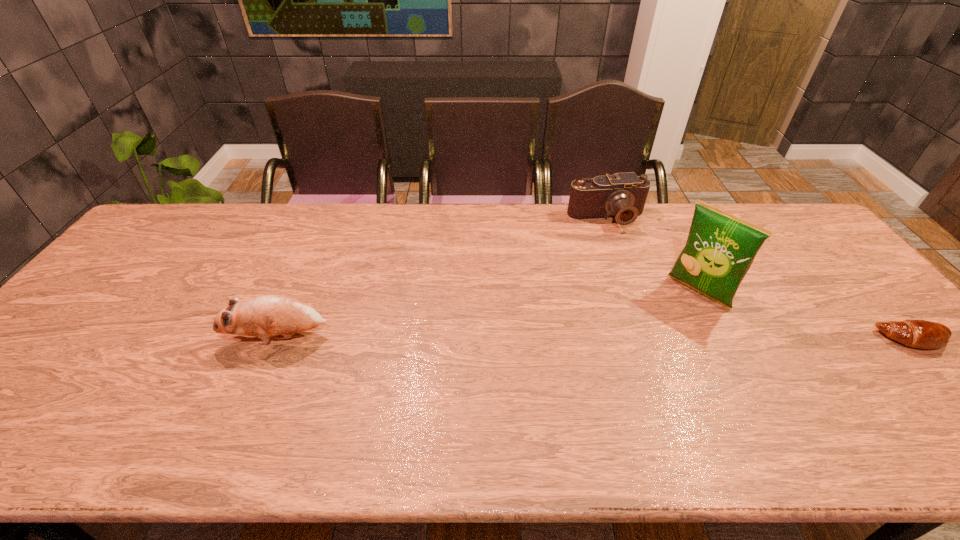
Where is `vacant spot on the desktop that is between the hamster and the rightmost object and is positioned on the front-facing side of the third nearest object`? Image resolution: width=960 pixels, height=540 pixels. vacant spot on the desktop that is between the hamster and the rightmost object and is positioned on the front-facing side of the third nearest object is located at coordinates (651, 339).

Locate an element on the screen. vacant spot on the desktop that is between the hamster and the shortest object and is positioned on the front-facing side of the camera is located at coordinates (670, 339).